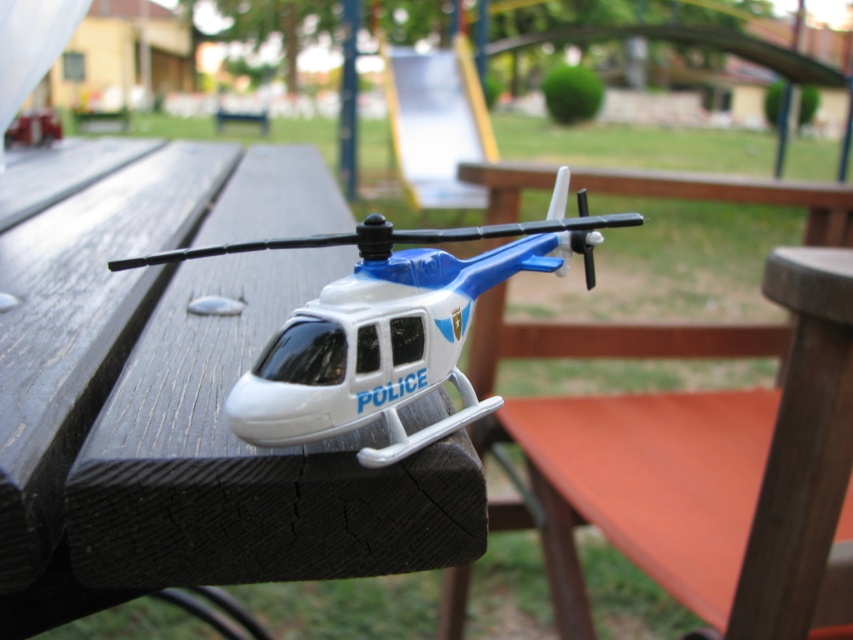
You are a park visitor who wants to place a small toy on the picnic table. You see the black wood table at center and the white plastic helicopter at center. Can you place your toy on the table without moving the helicopter?

The black wood table at center is positioned over white plastic helicopter at center, meaning the helicopter is already occupying the central area. Therefore, you cannot place your toy there without moving the helicopter.

You are standing at the edge of a park and see the black wood table at center and the white plastic helicopter at center. Which object is closer to you?

The black wood table at center is closer to you because it is in front of the white plastic helicopter at center.